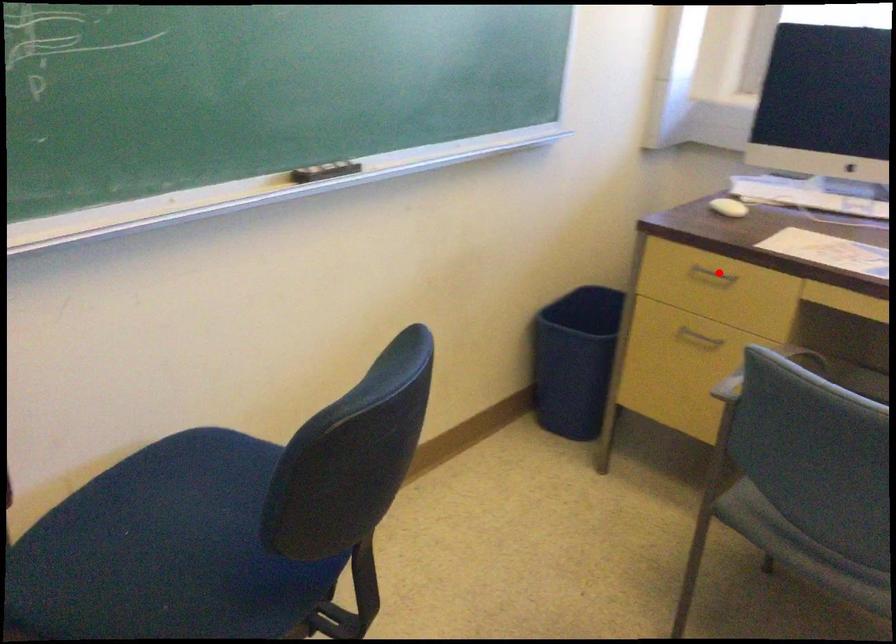
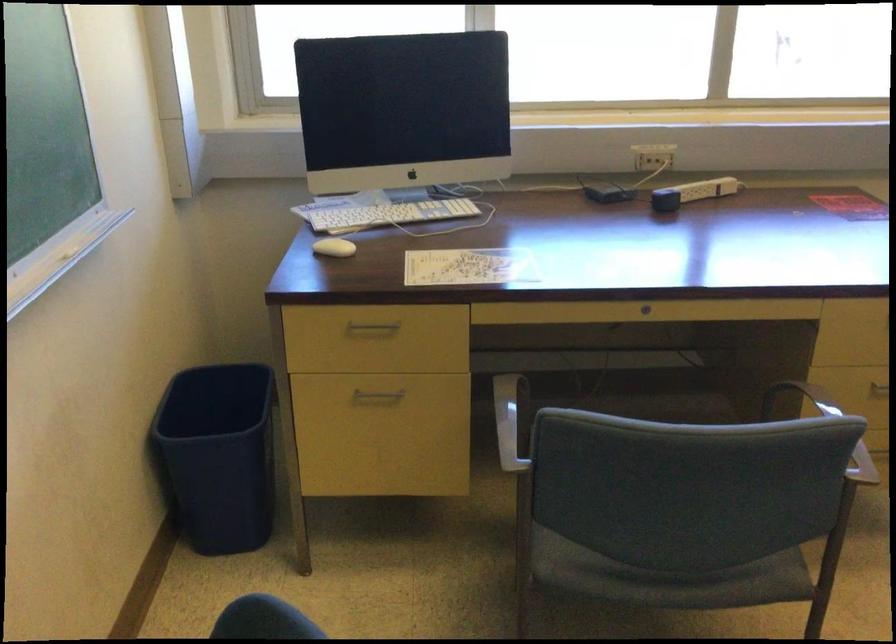
Question: A red point is marked in image1. In image2, is the corresponding 3D point closer to the camera or farther? Reply with the corresponding letter.

Choices:
 (A) The corresponding 3D point is closer.
 (B) The corresponding 3D point is farther.

Answer: (A)